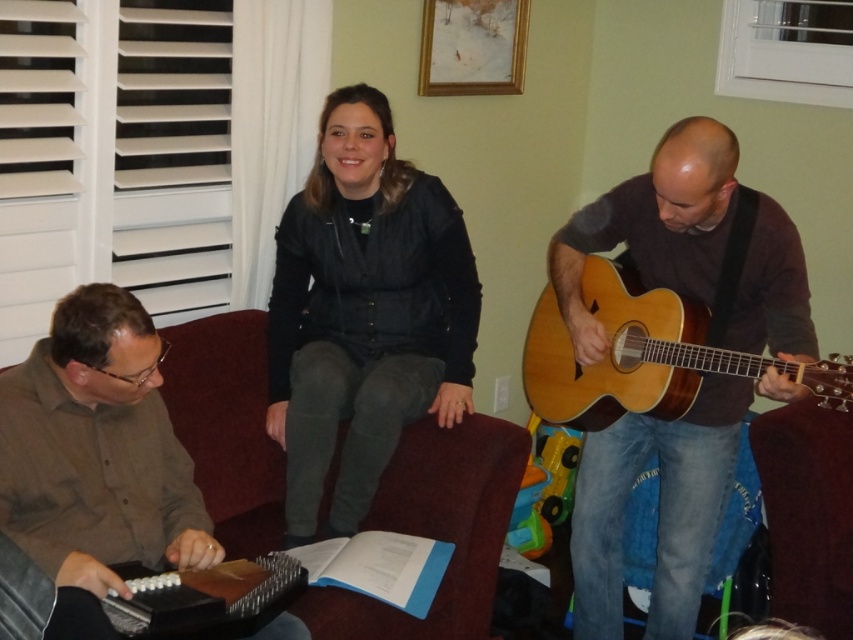
You are a photographer planning to take a portrait of the musician holding the matte brown guitar at right. You need to ensure that the guitar is visible above the black leather jacket at center in the photo. Is this possible based on their current positions?

Yes, the matte brown guitar at right is taller than the black leather jacket at center, so it should be visible above the jacket in the photo.

You are a photographer planning to take a closeup shot of the matte brown guitar at right and the brown shirt at left. Which object should you zoom in on to ensure both are in focus without moving the camera?

The matte brown guitar at right is bigger than the brown shirt at left, so you should zoom in on the matte brown guitar at right to ensure both are in focus without moving the camera.

You are a photographer standing in front of the couch. You want to take a photo of the matte brown guitar at right and the brown shirt at left. Which object should you focus on first if you want to capture both clearly in the same frame?

You should focus on the matte brown guitar at right first because it is closer to you than the brown shirt at left, which is further away. This will ensure both are in focus as the depth of field may capture the background subject adequately.